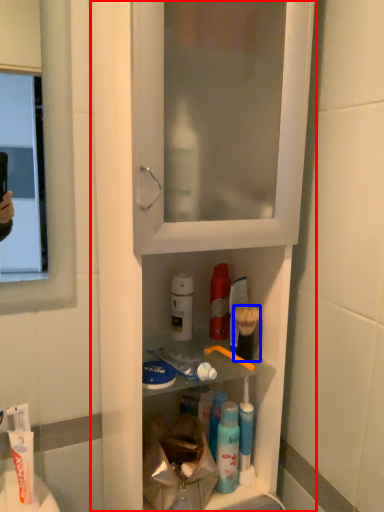
Question: Which of the following is the farthest to the observer, cabinetry (highlighted by a red box) or brush (highlighted by a blue box)?

Choices:
 (A) cabinetry
 (B) brush

Answer: (B)